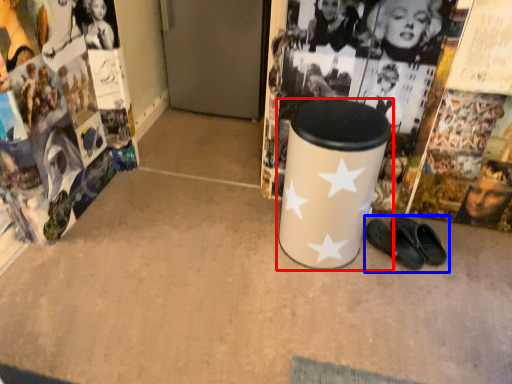
Question: Which of the following is the closest to the observer, waste container (highlighted by a red box) or footwear (highlighted by a blue box)?

Choices:
 (A) waste container
 (B) footwear

Answer: (A)